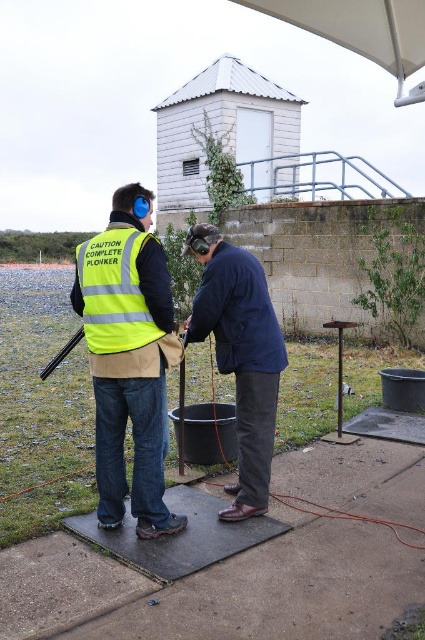
Question: Is concrete slab at center below yellow reflective safety vest at left?

Choices:
 (A) no
 (B) yes

Answer: (B)

Question: Is concrete slab at center closer to camera compared to yellow reflective safety vest at left?

Choices:
 (A) no
 (B) yes

Answer: (B)

Question: Which of the following is the closest to the observer?

Choices:
 (A) (95, 314)
 (B) (339, 563)
 (C) (277, 332)

Answer: (B)

Question: Can you confirm if concrete slab at center is thinner than yellow reflective safety vest at left?

Choices:
 (A) no
 (B) yes

Answer: (A)

Question: Which is nearer to the concrete slab at center?

Choices:
 (A) dark blue fabric at center
 (B) yellow reflective safety vest at left

Answer: (A)

Question: Which point is closer to the camera?

Choices:
 (A) (251, 464)
 (B) (130, 273)

Answer: (B)